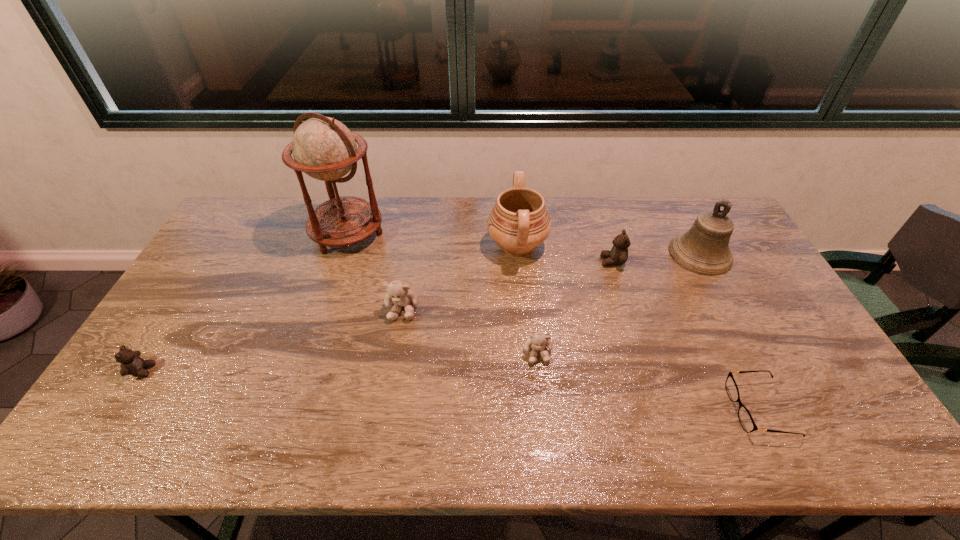
The width and height of the screenshot is (960, 540). I want to click on free space located on the face of the farthest teddy bear, so click(537, 261).

This screenshot has width=960, height=540. I want to click on blank area located 0.150m on the face of the third object from left to right, so click(x=393, y=368).

At what (x,y) coordinates should I click in order to perform the action: click on vacant space located 0.070m on the face of the left brown teddy bear. Please return your answer as a coordinate pair (x, y). The width and height of the screenshot is (960, 540). Looking at the image, I should click on (180, 370).

Where is `free spot located 0.140m on the face of the third teddy bear from left to right`? The height and width of the screenshot is (540, 960). free spot located 0.140m on the face of the third teddy bear from left to right is located at coordinates (544, 415).

Where is `free spot located 0.360m on the front-facing side of the shortest object`? The width and height of the screenshot is (960, 540). free spot located 0.360m on the front-facing side of the shortest object is located at coordinates (587, 409).

You are a GUI agent. You are given a task and a screenshot of the screen. Output one action in this format:
    pyautogui.click(x=<x>, y=<y>)
    Task: Click on the free point located 0.280m on the front-facing side of the shortest object
    The height and width of the screenshot is (540, 960).
    Given the screenshot: What is the action you would take?
    pyautogui.click(x=619, y=409)

At what (x,y) coordinates should I click in order to perform the action: click on vacant region located 0.320m on the front-facing side of the shortest object. Please return your answer as a coordinate pair (x, y). The image size is (960, 540). Looking at the image, I should click on (603, 409).

Locate an element on the screen. This screenshot has width=960, height=540. globe that is positioned at the far edge is located at coordinates (325, 149).

Identify the location of urn located at the far edge. (519, 222).

This screenshot has width=960, height=540. Identify the location of bell situated at the far edge. (704, 249).